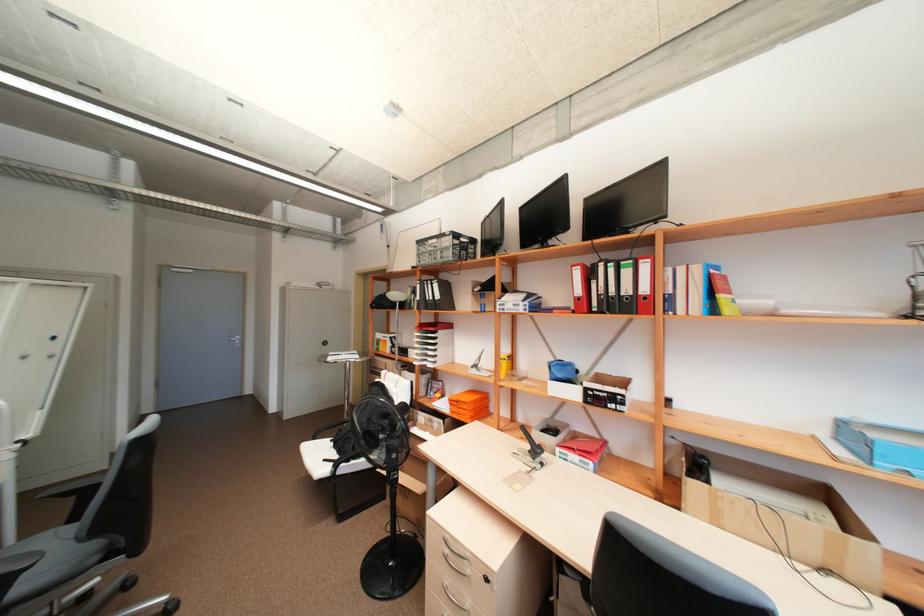
Identify the location of book. This screenshot has height=616, width=924. (701, 466).